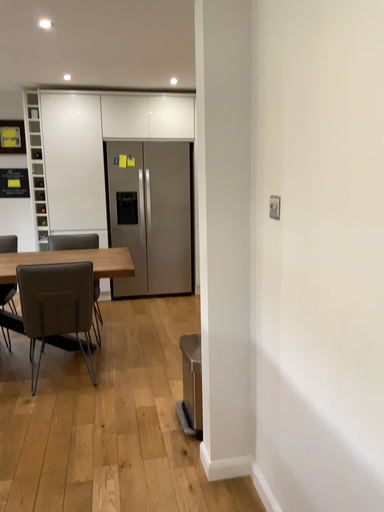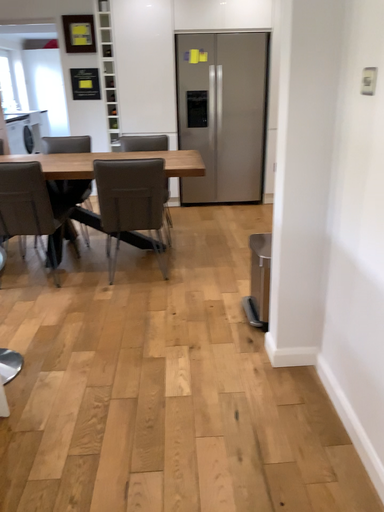
Question: How did the camera likely rotate when shooting the video?

Choices:
 (A) rotated left
 (B) rotated right

Answer: (A)